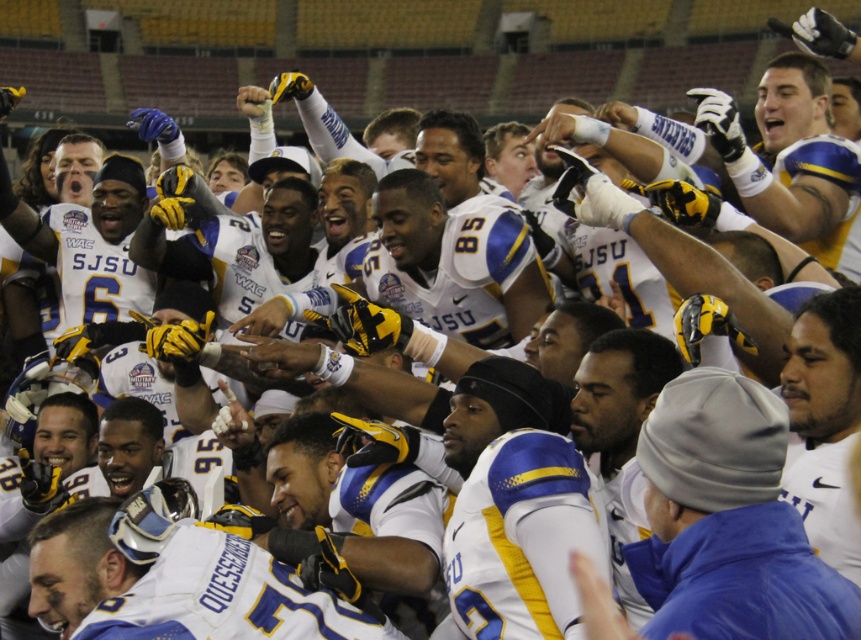
You are a photographer at the football field. You need to capture a photo of the white matte jersey at center and the matte blue jersey at upper right. Based on their positions, which jersey should you focus on first if you want to maintain both in the frame without moving the camera?

The white matte jersey at center is located below the matte blue jersey at upper right, so you should focus on the matte blue jersey at upper right first to ensure both are within the frame without moving the camera.

You are a photographer standing in front of the football players. You want to take a photo of the white matte jersey at center and the matte blue jersey at upper right. Which jersey will appear larger in your photo?

The white matte jersey at center will appear larger in the photo because it is closer to the viewer than the matte blue jersey at upper right.